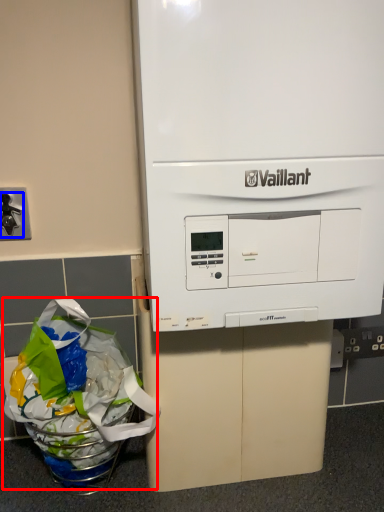
Question: Which object is further to the camera taking this photo, grocery bag (highlighted by a red box) or faucet (highlighted by a blue box)?

Choices:
 (A) grocery bag
 (B) faucet

Answer: (B)